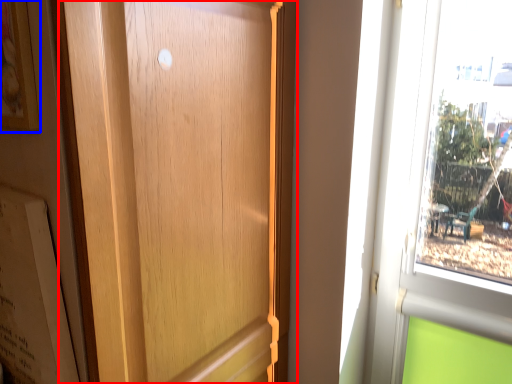
Question: Which object is further to the camera taking this photo, door (highlighted by a red box) or picture frame (highlighted by a blue box)?

Choices:
 (A) door
 (B) picture frame

Answer: (B)